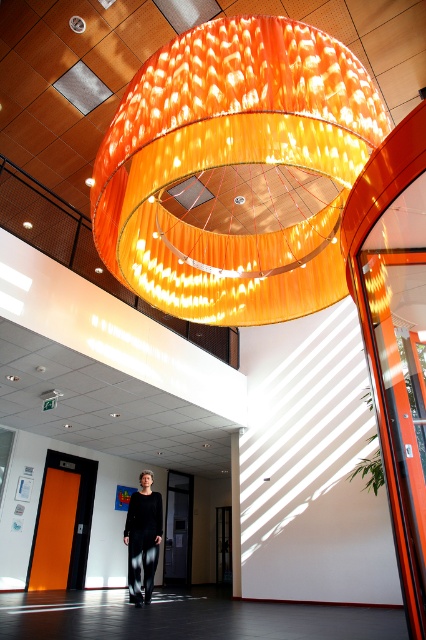
Question: Does orange glossy chandelier at center lie in front of black textured pants at center?

Choices:
 (A) no
 (B) yes

Answer: (B)

Question: Does orange glossy chandelier at center have a smaller size compared to black textured pants at center?

Choices:
 (A) no
 (B) yes

Answer: (A)

Question: Which of the following is the farthest from the observer?

Choices:
 (A) orange glossy chandelier at center
 (B) black textured pants at center

Answer: (B)

Question: Does orange glossy chandelier at center have a smaller size compared to black textured pants at center?

Choices:
 (A) yes
 (B) no

Answer: (B)